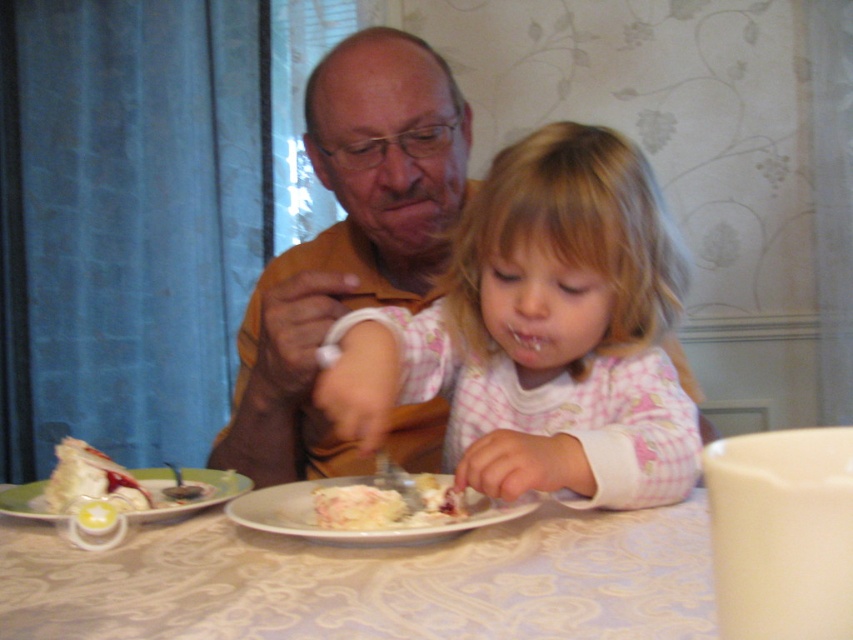
Based on the scene described, where is the white lace tablecloth at center in relation to the brown shirt at center?

The white lace tablecloth at center is to the left of the brown shirt at center.

What is located at the point with coordinates (368, 580) in the image?

The point at coordinates (368, 580) indicates the location of the white lace tablecloth at center.

You are a photographer trying to capture a closeup shot of the white matte plate at center without including the pink checkered pajamas at center. Is this possible given their sizes?

The pink checkered pajamas at center is bigger than the white matte plate at center, so it might block the view of the plate. You need to adjust your angle or move closer to frame only the plate.